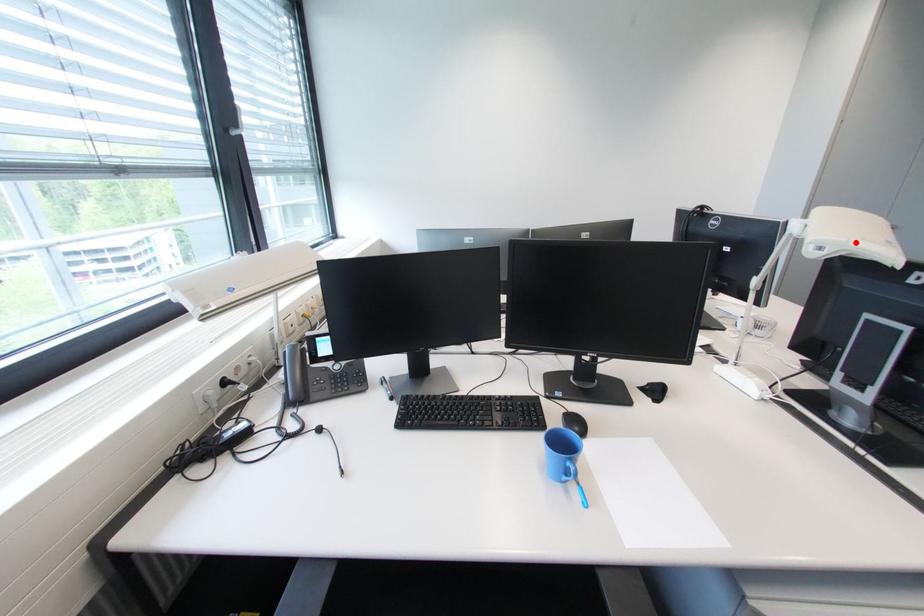
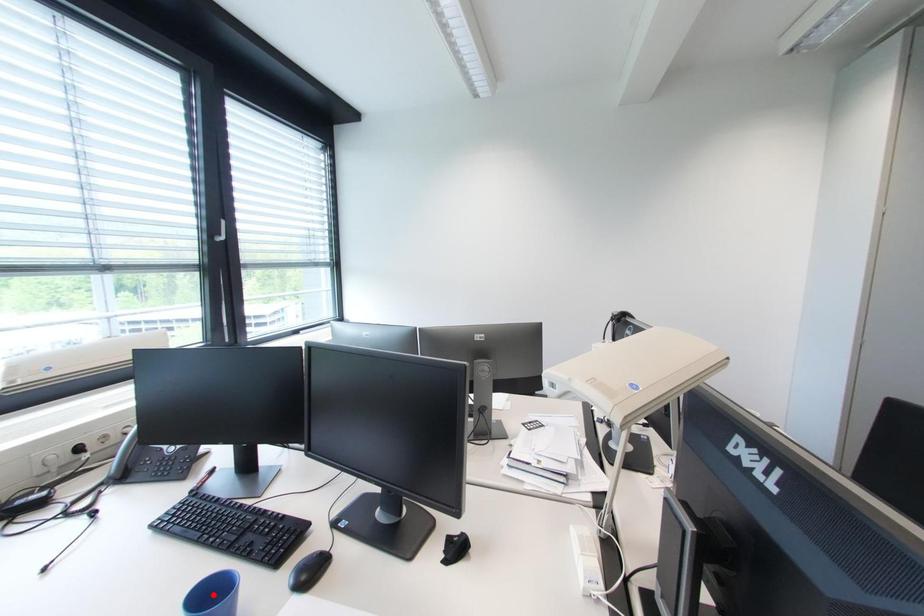
I am providing you with two images of the same scene from different viewpoints. A red point is marked on the first image and another point is marked on the second image. Are the points marked in image1 and image2 representing the same 3D position?

No